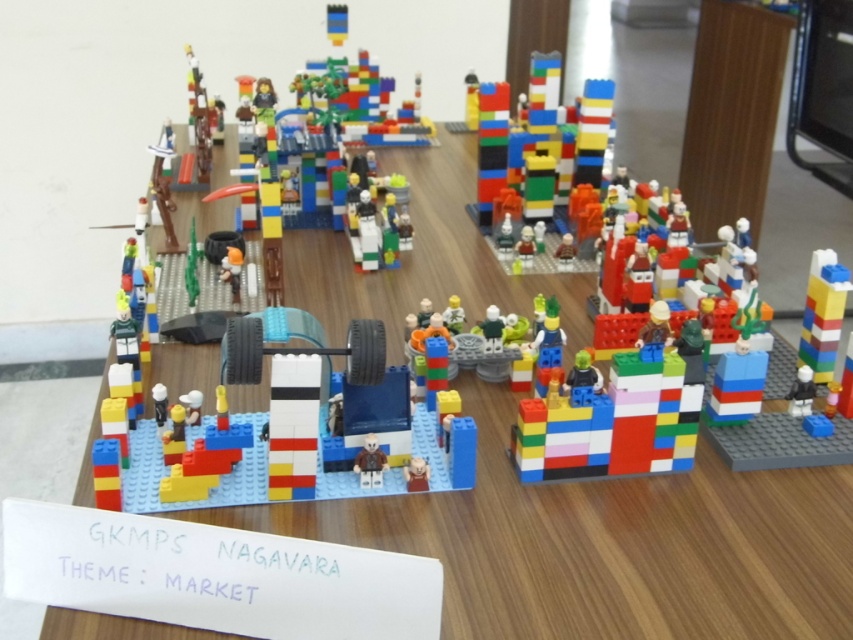
Question: Which point is farther to the camera?

Choices:
 (A) matte brown minifigure at center
 (B) smooth blue brick wall at center

Answer: (A)

Question: Where is smooth blue brick wall at center located in relation to matte brown minifigure at center in the image?

Choices:
 (A) above
 (B) below

Answer: (A)

Question: Which point is farther to the camera?

Choices:
 (A) smooth blue brick wall at center
 (B) matte brown minifigure at center

Answer: (B)

Question: Which of the following is the farthest from the observer?

Choices:
 (A) smooth blue brick wall at center
 (B) matte brown minifigure at center

Answer: (B)

Question: Is smooth blue brick wall at center to the left of matte brown minifigure at center from the viewer's perspective?

Choices:
 (A) yes
 (B) no

Answer: (A)

Question: Considering the relative positions of smooth blue brick wall at center and matte brown minifigure at center in the image provided, where is smooth blue brick wall at center located with respect to matte brown minifigure at center?

Choices:
 (A) right
 (B) left

Answer: (B)